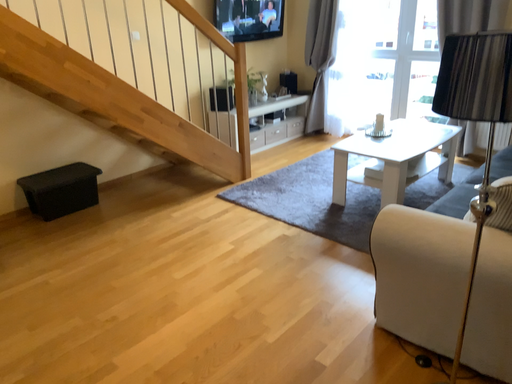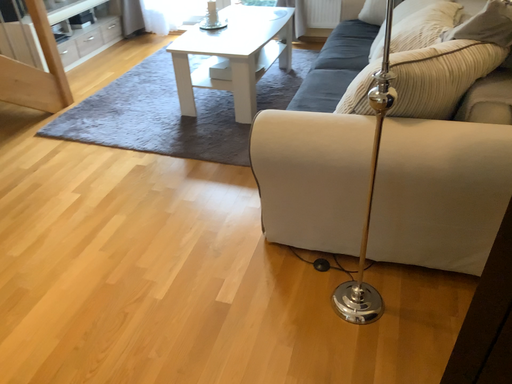
Question: How did the camera likely rotate when shooting the video?

Choices:
 (A) rotated upward
 (B) rotated downward

Answer: (B)